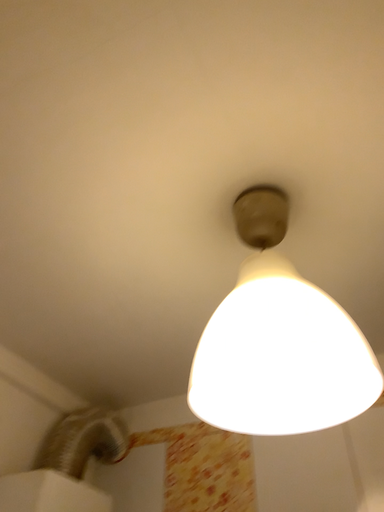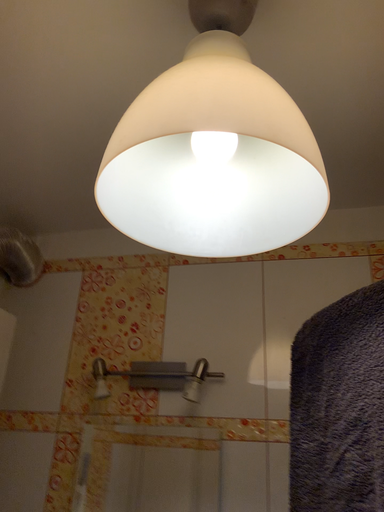
Question: Which way did the camera rotate in the video?

Choices:
 (A) rotated right
 (B) rotated left

Answer: (A)